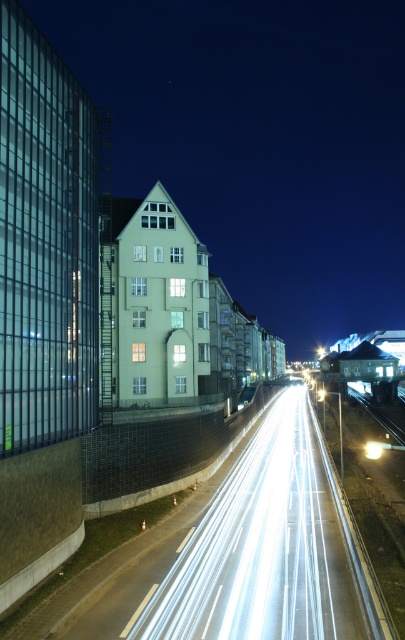
You are a pedestrian standing on the sidewalk and see the metallic silver car at center and the white glossy light at center in the distance. Which object is closer to you?

The metallic silver car at center is closer to you because it is positioned above the white glossy light at center, indicating it is nearer in the visual hierarchy.

You are driving a car at night and see the white glossy highway at center and the white glossy light at center in your view. Which object is nearer to your car?

The white glossy highway at center is closer to the viewer than the white glossy light at center, so the highway is nearer to your car.

Looking at this image, you are a delivery driver who needs to reach the white glossy highway at center as quickly as possible. What is the shortest path you can take from your current position?

The shortest path to the white glossy highway at center would be to head directly towards it since it is only 23.79 meters away from your current position.